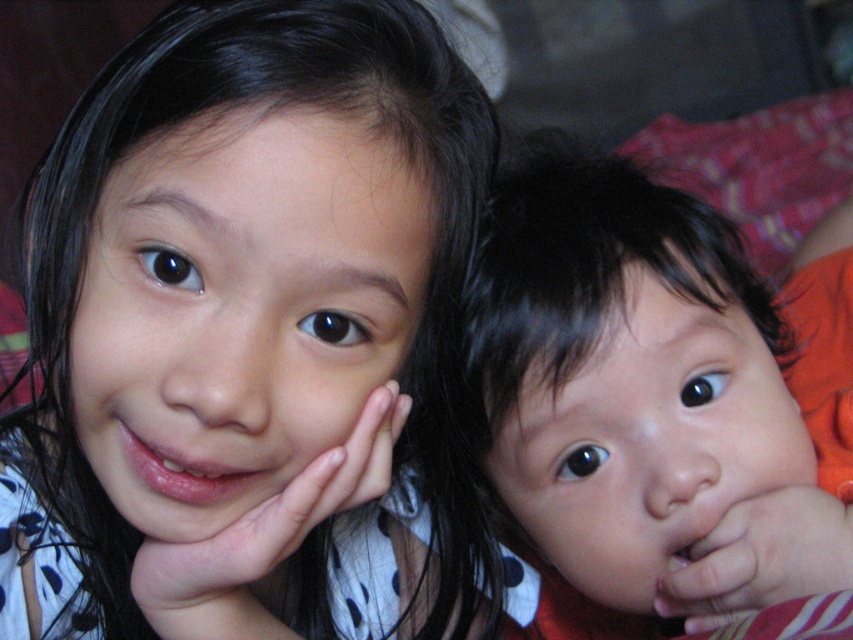
You are a photographer trying to capture a candid shot of the smooth skin face at center and the pink matte hand at lower left. Based on their positions, can you tell which object is closer to the camera?

The smooth skin face at center is located above the pink matte hand at lower left, so it is closer to the camera than the pink matte hand at lower left.

You are a photographer trying to capture a closeup of the smooth skin face at center without the pink matte hand at lower left blocking the view. Based on their sizes, can you position the camera so that the hand is entirely out of the frame?

The smooth skin face at center is taller than the pink matte hand at lower left, so yes, you can position the camera higher to exclude the pink matte hand at lower left from the frame.